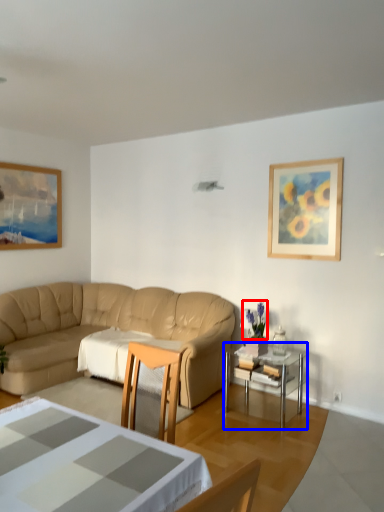
Question: Which point is closer to the camera, plant (highlighted by a red box) or table (highlighted by a blue box)?

Choices:
 (A) plant
 (B) table

Answer: (B)